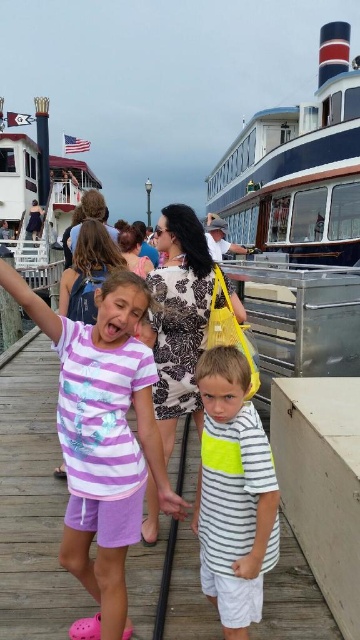
Question: Considering the real-world distances, which object is farthest from the striped cotton shirt at center?

Choices:
 (A) purple striped shirt at center
 (B) blue polished wood boat at upper center
 (C) white wooden boat at upper left

Answer: (C)

Question: Which object is positioned closest to the striped cotton shirt at center?

Choices:
 (A) white wooden boat at upper left
 (B) blue polished wood boat at upper center

Answer: (B)

Question: Does blue polished wood boat at upper center have a smaller size compared to striped cotton shirt at center?

Choices:
 (A) no
 (B) yes

Answer: (A)

Question: Considering the relative positions of blue polished wood boat at upper center and white wooden boat at upper left in the image provided, where is blue polished wood boat at upper center located with respect to white wooden boat at upper left?

Choices:
 (A) below
 (B) above

Answer: (B)

Question: Can you confirm if purple striped shirt at center is thinner than striped cotton shirt at center?

Choices:
 (A) no
 (B) yes

Answer: (A)

Question: Which object is closer to the camera taking this photo?

Choices:
 (A) blue polished wood boat at upper center
 (B) white wooden boat at upper left
 (C) striped cotton shirt at center
 (D) purple striped shirt at center

Answer: (D)